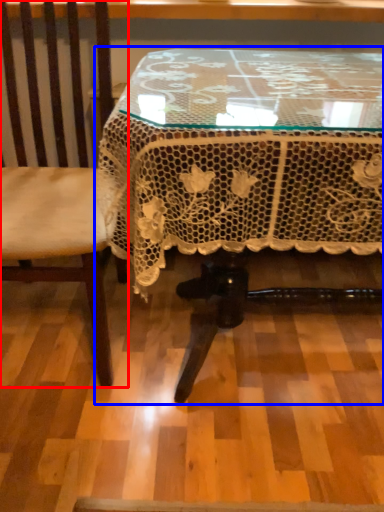
Question: Which point is closer to the camera, chair (highlighted by a red box) or table (highlighted by a blue box)?

Choices:
 (A) chair
 (B) table

Answer: (B)